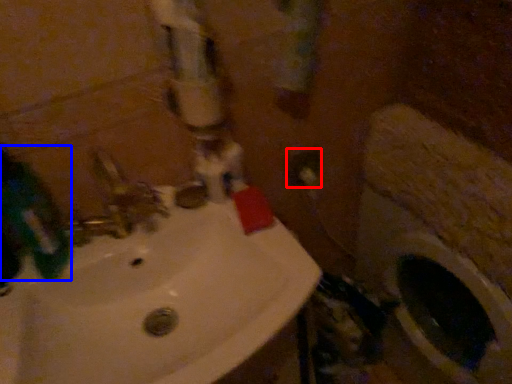
Question: Which object appears farthest to the camera in this image, electric outlet (highlighted by a red box) or mouthwash (highlighted by a blue box)?

Choices:
 (A) electric outlet
 (B) mouthwash

Answer: (A)